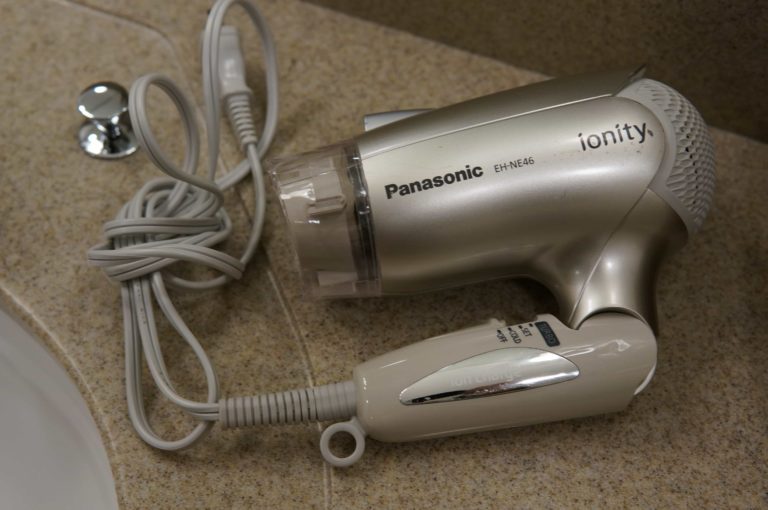
In order to click on blow dryer cord in this screenshot , I will do `click(184, 261)`.